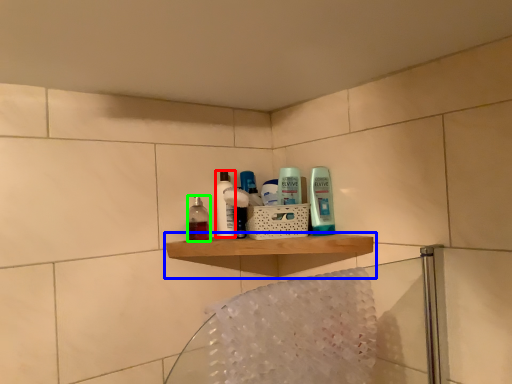
Question: Based on their relative distances, which object is nearer to toiletry (highlighted by a red box)? Choose from shelf (highlighted by a blue box) and mouthwash (highlighted by a green box).

Choices:
 (A) shelf
 (B) mouthwash

Answer: (B)